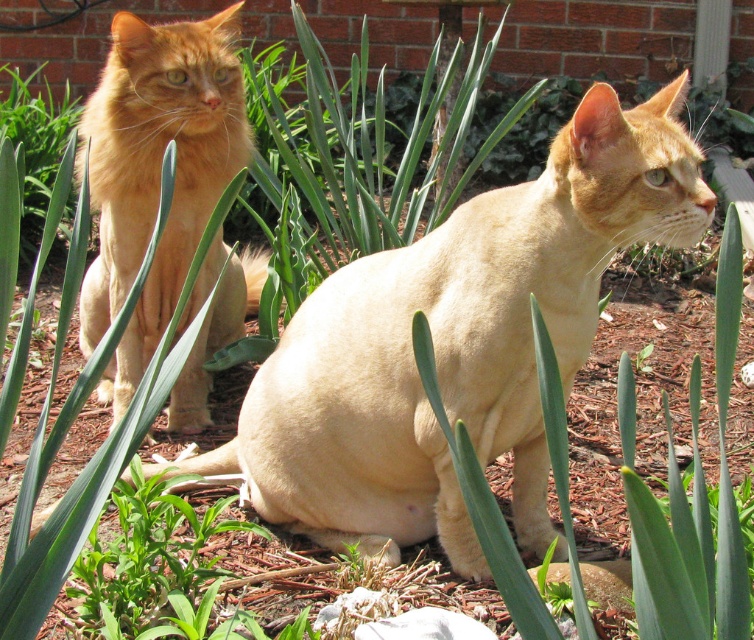
You are a photographer trying to capture both the matte orange cat at left and the orange fur cat at upper left in a single frame. Based on their positions, which cat would appear closer to the camera?

The matte orange cat at left would appear closer to the camera because it is wider than the orange fur cat at upper left, indicating it is nearer due to perspective.

You are a photographer standing at the center of the garden. You want to take a photo of the matte orange cat at left. Where should you aim your camera?

You should aim your camera at point (458, 342) to capture the matte orange cat at left.

You are a photographer setting up a camera to capture the matte orange cat at left and the orange fur cat at upper left. Since you want to ensure both cats are in frame, which cat should you position the camera closer to in order to include both?

The matte orange cat at left is to the right of orange fur cat at upper left, so positioning the camera closer to the orange fur cat at upper left would help include both in the frame since it is further to the left.